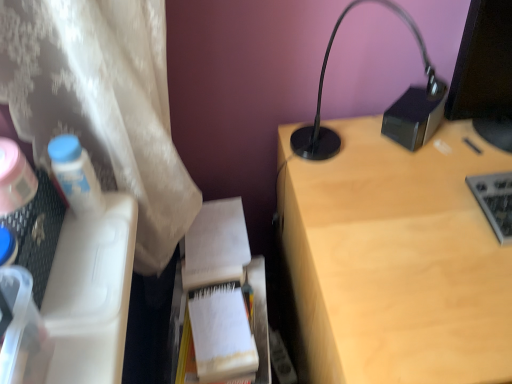
Question: Considering the positions of point (223, 223) and point (474, 64), is point (223, 223) closer or farther from the camera than point (474, 64)?

Choices:
 (A) farther
 (B) closer

Answer: (A)

Question: From the image's perspective, is white paper notebook at center above or below black glossy monitor at upper right?

Choices:
 (A) above
 (B) below

Answer: (B)

Question: Estimate the real-world distances between objects in this image. Which object is closer to the white paper notebook at center?

Choices:
 (A) light wood desk at upper right
 (B) white paper at center
 (C) black glossy monitor at upper right
 (D) white plastic bottle at left
 (E) black metallic lamp at upper right

Answer: (B)

Question: Based on their relative distances, which object is farther from the white paper notebook at center?

Choices:
 (A) black matte speaker at upper right
 (B) white paper at center
 (C) black metallic lamp at upper right
 (D) gray metallic keyboard at right
 (E) black glossy monitor at upper right

Answer: (E)